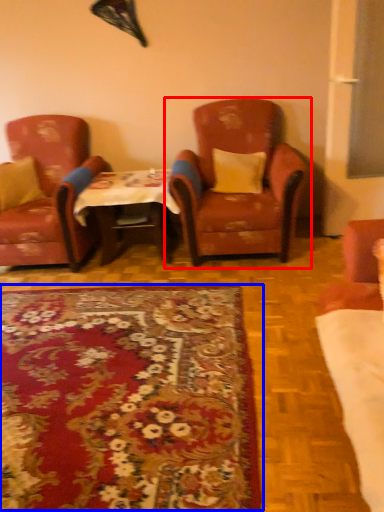
Question: Which object is further to the camera taking this photo, chair (highlighted by a red box) or mat (highlighted by a blue box)?

Choices:
 (A) chair
 (B) mat

Answer: (A)